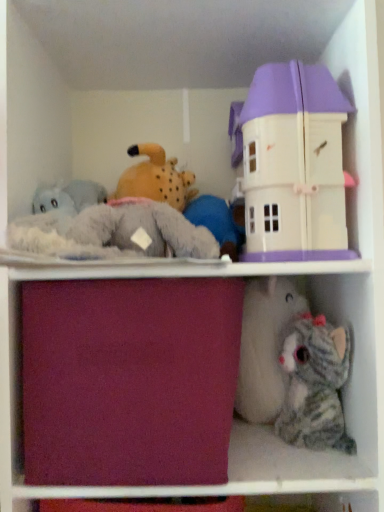
Question: Could pastel purple plastic dollhouse at upper right, marked as the 1th toy in a top-to-bottom arrangement, be considered to be inside burgundy fabric drawer at center?

Choices:
 (A) no
 (B) yes

Answer: (A)

Question: Can you confirm if burgundy fabric drawer at center is positioned to the left of pastel purple plastic dollhouse at upper right, marked as the 1th toy in a top-to-bottom arrangement?

Choices:
 (A) no
 (B) yes

Answer: (B)

Question: Does burgundy fabric drawer at center have a lesser width compared to pastel purple plastic dollhouse at upper right, marked as the 1th toy in a top-to-bottom arrangement?

Choices:
 (A) no
 (B) yes

Answer: (A)

Question: Is burgundy fabric drawer at center oriented away from pastel purple plastic dollhouse at upper right, marked as the 1th toy in a top-to-bottom arrangement?

Choices:
 (A) no
 (B) yes

Answer: (A)

Question: Considering the relative sizes of burgundy fabric drawer at center and pastel purple plastic dollhouse at upper right, marked as the 1th toy in a top-to-bottom arrangement, in the image provided, is burgundy fabric drawer at center smaller than pastel purple plastic dollhouse at upper right, marked as the 1th toy in a top-to-bottom arrangement,?

Choices:
 (A) yes
 (B) no

Answer: (B)

Question: Can you confirm if burgundy fabric drawer at center is taller than pastel purple plastic dollhouse at upper right, placed as the 2th toy when sorted from bottom to top?

Choices:
 (A) no
 (B) yes

Answer: (A)

Question: From a real-world perspective, is striped plush cat at lower right, the second toy from the top, on burgundy fabric drawer at center?

Choices:
 (A) no
 (B) yes

Answer: (A)

Question: Does striped plush cat at lower right, the second toy from the top, appear on the left side of burgundy fabric drawer at center?

Choices:
 (A) no
 (B) yes

Answer: (A)

Question: Does striped plush cat at lower right, marked as the 1th toy in a bottom-to-top arrangement, have a lesser height compared to burgundy fabric drawer at center?

Choices:
 (A) yes
 (B) no

Answer: (A)

Question: Is striped plush cat at lower right, marked as the 1th toy in a bottom-to-top arrangement, oriented towards burgundy fabric drawer at center?

Choices:
 (A) yes
 (B) no

Answer: (B)

Question: Can burgundy fabric drawer at center be found inside striped plush cat at lower right, marked as the 1th toy in a bottom-to-top arrangement?

Choices:
 (A) no
 (B) yes

Answer: (A)

Question: From the image's perspective, is striped plush cat at lower right, marked as the 1th toy in a bottom-to-top arrangement, above burgundy fabric drawer at center?

Choices:
 (A) yes
 (B) no

Answer: (B)

Question: Would you consider striped plush cat at lower right, the second toy from the top, to be distant from pastel purple plastic dollhouse at upper right, placed as the 2th toy when sorted from bottom to top?

Choices:
 (A) no
 (B) yes

Answer: (A)